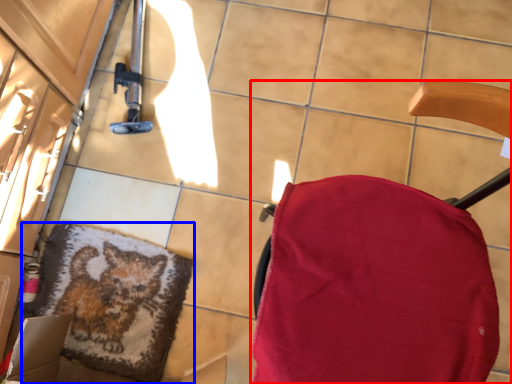
Question: Which of the following is the closest to the observer, furniture (highlighted by a red box) or mat (highlighted by a blue box)?

Choices:
 (A) furniture
 (B) mat

Answer: (A)